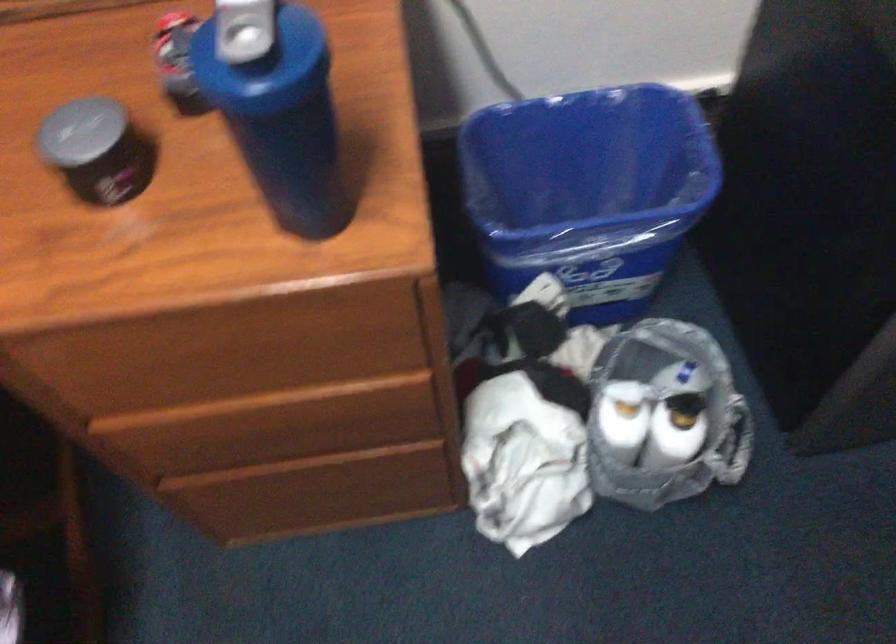
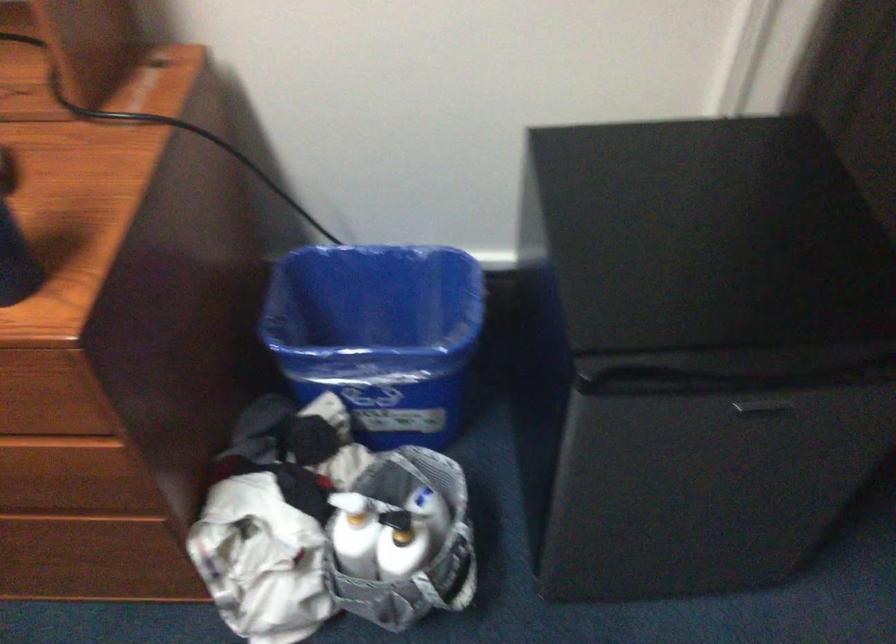
Find the pixel in the second image that matches [347,377] in the first image.

(56, 433)